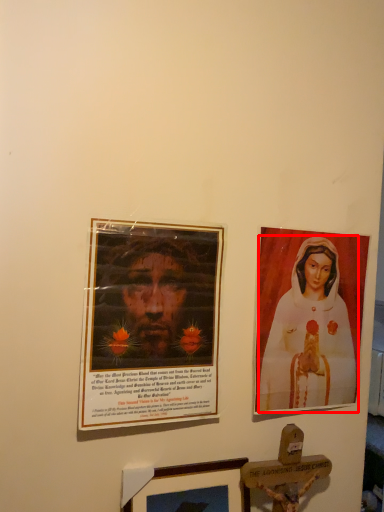
Question: From the image's perspective, considering the relative positions of woman (annotated by the red box) and picture frame in the image provided, where is woman (annotated by the red box) located with respect to the staircase?

Choices:
 (A) below
 (B) above

Answer: (B)